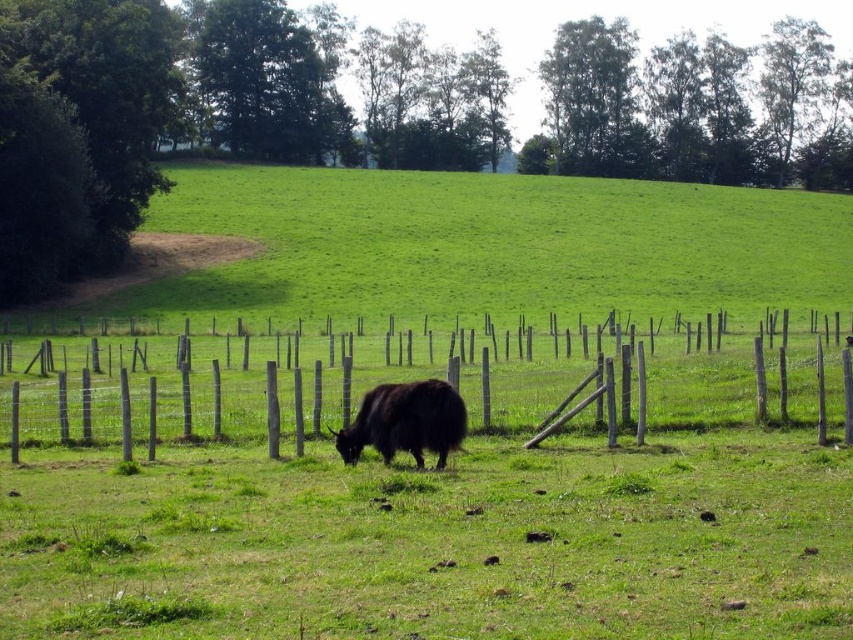
You are a farmer standing at the wooden post fence at center and want to approach the black fuzzy yak at center to check its health. Given that the fence is 1.5 meters wide, can you walk through the fence to reach the yak?

The wooden post fence at center and black fuzzy yak at center are 14.73 meters apart from each other. Since the fence is only 1.5 meters wide, you can walk through the fence to reach the black fuzzy yak at center as the distance between them allows passage.

You are standing in the rural landscape and want to approach the black fuzzy yak at center. Which side of the wooden post fence at center should you go around to reach the yak?

You should go around the right side of the wooden post fence at center to reach the black fuzzy yak at center, since the fence is to the left of the yak.